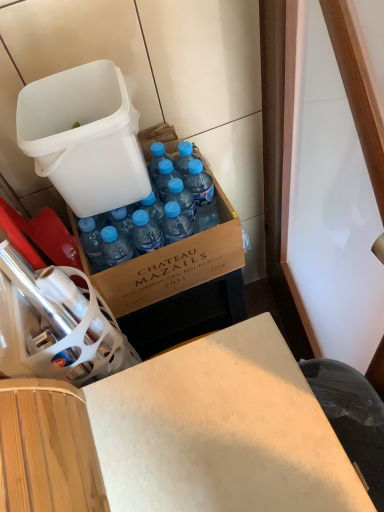
The height and width of the screenshot is (512, 384). What do you see at coordinates (202, 196) in the screenshot?
I see `blue plastic bottle at center` at bounding box center [202, 196].

In order to face wooden desk at center, should I rotate leftwards or rightwards?

You should rotate left by 1.984 degrees.

Locate an element on the screen. The width and height of the screenshot is (384, 512). blue plastic bottle at center is located at coordinates (202, 196).

Can you tell me how much wooden desk at center and white plastic trash can at upper left differ in facing direction?

87.3 degrees.

Considering the relative sizes of wooden desk at center and white plastic trash can at upper left in the image provided, is wooden desk at center taller than white plastic trash can at upper left?

Yes.

Measure the distance from wooden desk at center to white plastic trash can at upper left.

16.92 inches.

Based on their positions, is wooden desk at center located to the left or right of white plastic trash can at upper left?

Clearly, wooden desk at center is on the right of white plastic trash can at upper left in the image.

Which object is thinner, blue plastic bottle at center or wooden desk at center?

blue plastic bottle at center.

Would you say blue plastic bottle at center is a long distance from wooden desk at center?

No, blue plastic bottle at center is in close proximity to wooden desk at center.

You are a GUI agent. You are given a task and a screenshot of the screen. Output one action in this format:
    pyautogui.click(x=<x>, y=<y>)
    Task: Click on the desk below the blue plastic bottle at center (from the image's perspective)
    The height and width of the screenshot is (512, 384).
    Given the screenshot: What is the action you would take?
    pyautogui.click(x=178, y=435)

From the image's perspective, between blue plastic bottle at center and wooden desk at center, who is located below?

Result: wooden desk at center, from the image's perspective.

Which object is positioned more to the left, blue plastic bottle at center or white plastic trash can at upper left?

white plastic trash can at upper left is more to the left.

Locate an element on the screen. This screenshot has width=384, height=512. trash bin/can in front of the blue plastic bottle at center is located at coordinates (84, 137).

Is the depth of blue plastic bottle at center greater than that of white plastic trash can at upper left?

Yes, blue plastic bottle at center is behind white plastic trash can at upper left.

From a real-world perspective, is blue plastic bottle at center physically below white plastic trash can at upper left?

Yes.

Are white plastic trash can at upper left and blue plastic bottle at center far apart?

No, white plastic trash can at upper left is not far away from blue plastic bottle at center.

Does white plastic trash can at upper left come behind blue plastic bottle at center?

That is False.

Which is closer to the camera, (x=75, y=103) or (x=210, y=210)?

The point (x=75, y=103) is in front.

Locate an element on the screen. The width and height of the screenshot is (384, 512). trash bin/can lying above the blue plastic bottle at center (from the image's perspective) is located at coordinates (84, 137).

Which of these two, wooden desk at center or blue plastic bottle at center, stands taller?

wooden desk at center is taller.

Visually, is wooden desk at center positioned to the left or to the right of blue plastic bottle at center?

wooden desk at center is positioned on blue plastic bottle at center's left side.

Is blue plastic bottle at center at the back of wooden desk at center?

wooden desk at center does not have its back to blue plastic bottle at center.

Could you tell me if white plastic trash can at upper left is facing wooden desk at center?

No.

Which of these two, white plastic trash can at upper left or wooden desk at center, is wider?

wooden desk at center is wider.

This screenshot has width=384, height=512. I want to click on desk below the white plastic trash can at upper left (from a real-world perspective), so click(178, 435).

From the image's perspective, which is above, white plastic trash can at upper left or wooden desk at center?

white plastic trash can at upper left, from the image's perspective.

Where is `trash bin/can that appears above the wooden desk at center (from the image's perspective)`? This screenshot has width=384, height=512. trash bin/can that appears above the wooden desk at center (from the image's perspective) is located at coordinates (84, 137).

Where is `desk below the blue plastic bottle at center (from the image's perspective)`? desk below the blue plastic bottle at center (from the image's perspective) is located at coordinates (178, 435).

Which object lies further to the anchor point wooden desk at center, white plastic trash can at upper left or blue plastic bottle at center?

Among the two, white plastic trash can at upper left is located further to wooden desk at center.

Based on their spatial positions, is blue plastic bottle at center or wooden desk at center closer to white plastic trash can at upper left?

blue plastic bottle at center is closer to white plastic trash can at upper left.

From the image, which object appears to be farther from wooden desk at center, blue plastic bottle at center or white plastic trash can at upper left?

white plastic trash can at upper left lies further to wooden desk at center than the other object.

When comparing their distances from blue plastic bottle at center, does wooden desk at center or white plastic trash can at upper left seem closer?

white plastic trash can at upper left lies closer to blue plastic bottle at center than the other object.

Estimate the real-world distances between objects in this image. Which object is closer to white plastic trash can at upper left, wooden desk at center or blue plastic bottle at center?

blue plastic bottle at center lies closer to white plastic trash can at upper left than the other object.

From the image, which object appears to be farther from blue plastic bottle at center, white plastic trash can at upper left or wooden desk at center?

Among the two, wooden desk at center is located further to blue plastic bottle at center.

This screenshot has width=384, height=512. I want to click on bottle between white plastic trash can at upper left and wooden desk at center vertically, so click(x=202, y=196).